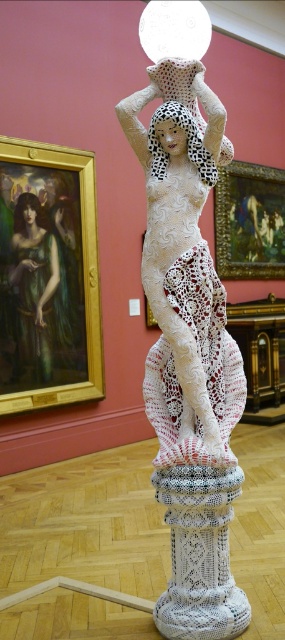
You are a visitor standing in front of the sculpture. You notice two points marked on the wall. The first point is at coordinates point [226,548], and the second is at point [208,280]. If you were to walk towards the sculpture, which point would you encounter first?

Point [226,548] is in front of point [208,280], so you would encounter point [226,548] first when walking towards the sculpture.

You are an art student who wants to photograph the white knitted pillar at center and the white crochet dress at center. To ensure both are in focus, you need to know which object is closer to you. Can you tell me which one is nearer?

The white knitted pillar at center is closer to the viewer than the white crochet dress at center, so the pillar is nearer.